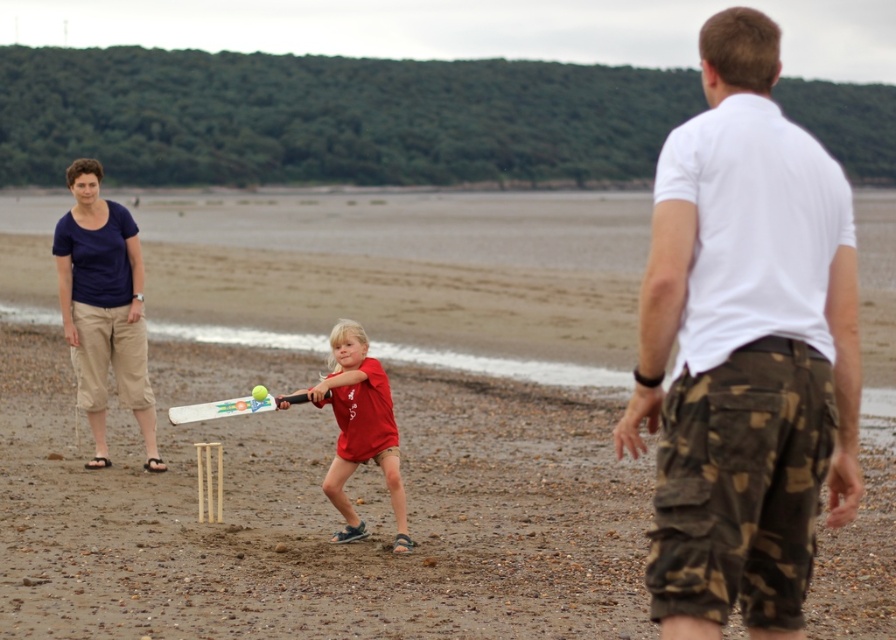
Between point (311, 216) and point (123, 346), which one is positioned behind?

Positioned behind is point (311, 216).

Is smooth sand at center positioned at the back of dark blue cotton t-shirt at left?

No, it is not.

Identify the location of smooth sand at center. This screenshot has width=896, height=640. (336, 429).

This screenshot has height=640, width=896. Identify the location of smooth sand at center. (336, 429).

Can you confirm if dark blue cotton t-shirt at left is bigger than white plastic bat at center?

Yes.

Is dark blue cotton t-shirt at left shorter than white plastic bat at center?

In fact, dark blue cotton t-shirt at left may be taller than white plastic bat at center.

The height and width of the screenshot is (640, 896). I want to click on dark blue cotton t-shirt at left, so click(102, 307).

Locate an element on the screen. Image resolution: width=896 pixels, height=640 pixels. dark blue cotton t-shirt at left is located at coordinates (102, 307).

Measure the distance between white camo shorts at right and camera.

The distance of white camo shorts at right from camera is 5.54 meters.

Is white camo shorts at right closer to the viewer compared to white plastic bat at center?

That is True.

You are a GUI agent. You are given a task and a screenshot of the screen. Output one action in this format:
    pyautogui.click(x=<x>, y=<y>)
    Task: Click on the white camo shorts at right
    The height and width of the screenshot is (640, 896).
    Given the screenshot: What is the action you would take?
    pyautogui.click(x=745, y=349)

The image size is (896, 640). Identify the location of white camo shorts at right. (745, 349).